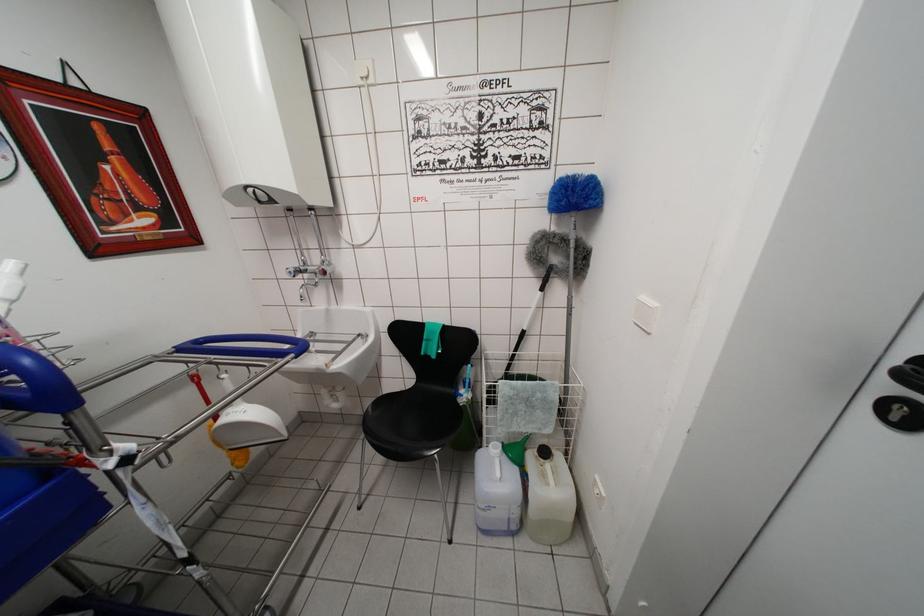
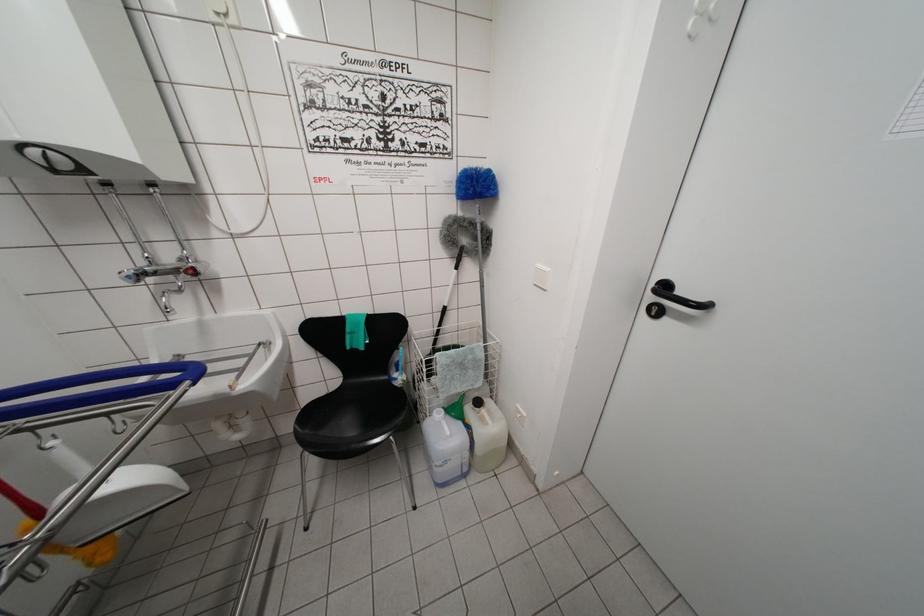
In the second image, find the point that corresponds to the point at 493,450 in the first image.

(438, 418)